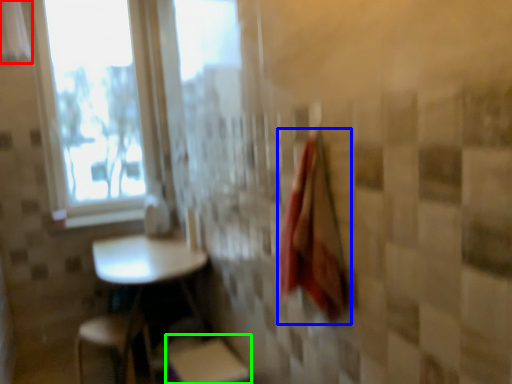
Question: Estimate the real-world distances between objects in this image. Which object is closer to curtain (highlighted by a red box), bath towel (highlighted by a blue box) or step stool (highlighted by a green box)?

Choices:
 (A) bath towel
 (B) step stool

Answer: (B)